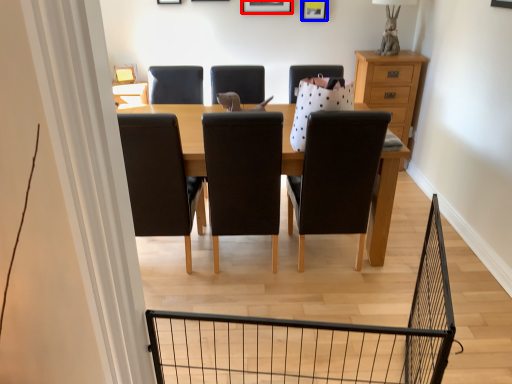
Question: Which point is further to the camera, picture frame (highlighted by a red box) or picture frame (highlighted by a blue box)?

Choices:
 (A) picture frame
 (B) picture frame

Answer: (B)